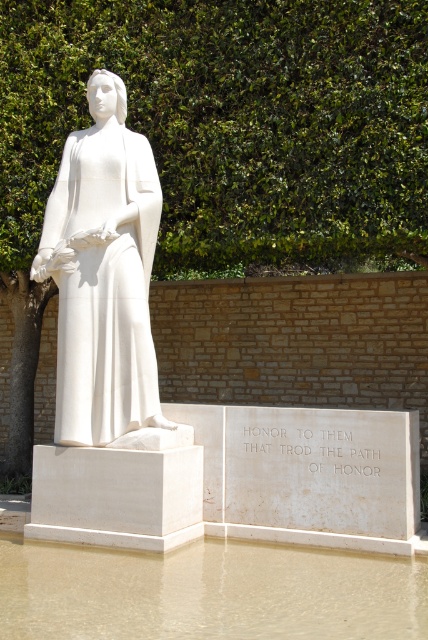
Looking at this image, you are standing in front of the statue and want to place a small flower at the base of the statue. The statue has two specific points marked at coordinates point (x=321, y=161) and point (x=14, y=556). Which point is closer to you when facing the statue?

Point (x=14, y=556) is closer to you when facing the statue because it is in front of point (x=321, y=161).

You are a visitor at a park and see the brown sediment water at lower center and the white marble statue at center. Which object is located to the right of the other?

The brown sediment water at lower center is positioned on the right side of white marble statue at center.